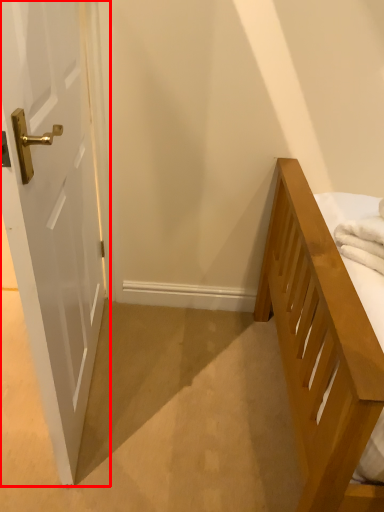
Question: Observing the image, what is the correct spatial positioning of door (annotated by the red box) in reference to bath towel?

Choices:
 (A) left
 (B) right

Answer: (A)